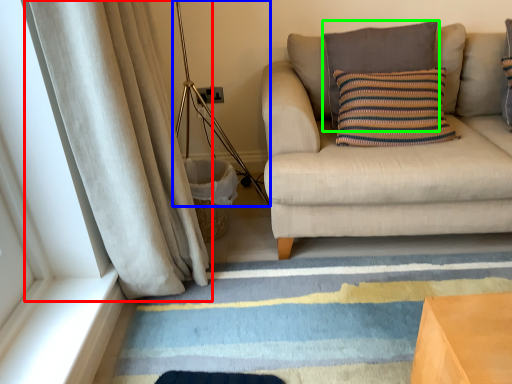
Question: Which object is positioned farthest from curtain (highlighted by a red box)? Select from lamp (highlighted by a blue box) and pillow (highlighted by a green box).

Choices:
 (A) lamp
 (B) pillow

Answer: (B)